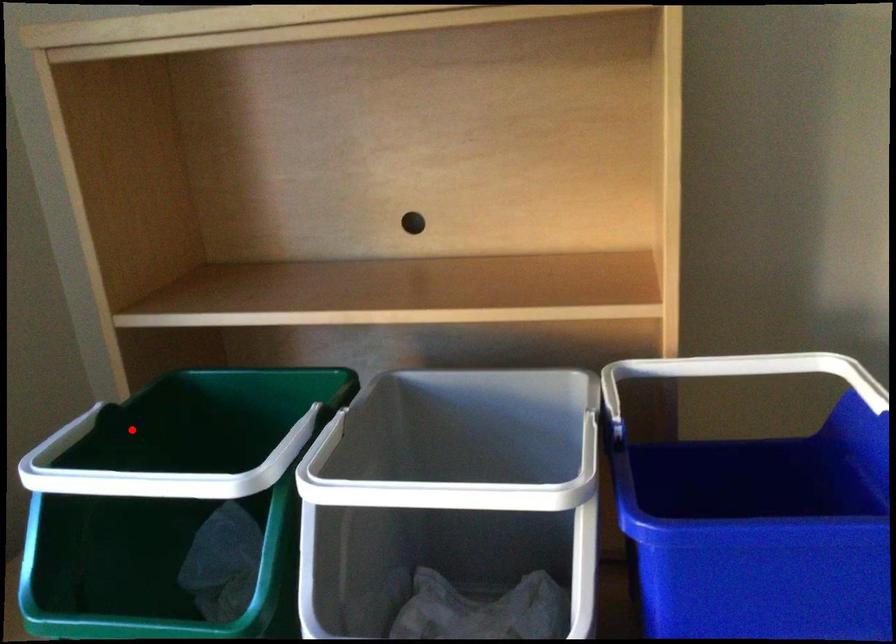
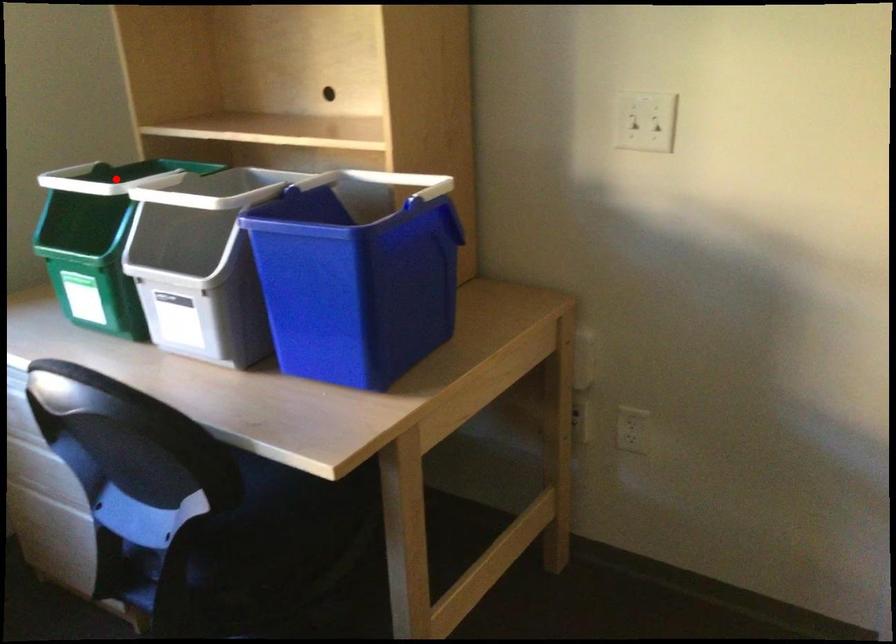
I am providing you with two images of the same scene from different viewpoints. A red point is marked on the first image and another point is marked on the second image. Does the point marked in image1 correspond to the same location as the one in image2?

Yes